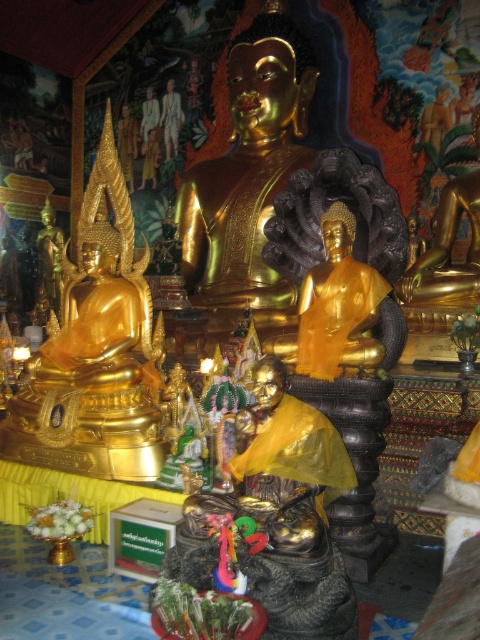
You are a temple guide who needs to move a 20 feet long ceremonial banner from the entrance to a display area near the gold polished statue at left. The path goes past the gold shiny statue at center. Is the banner too long to navigate the path between them?

The distance between the gold polished statue at left and the gold shiny statue at center is 19.61 feet. Since the banner is 20 feet long, it is slightly longer than the available space, making it difficult to navigate the path without folding or adjusting the banner.